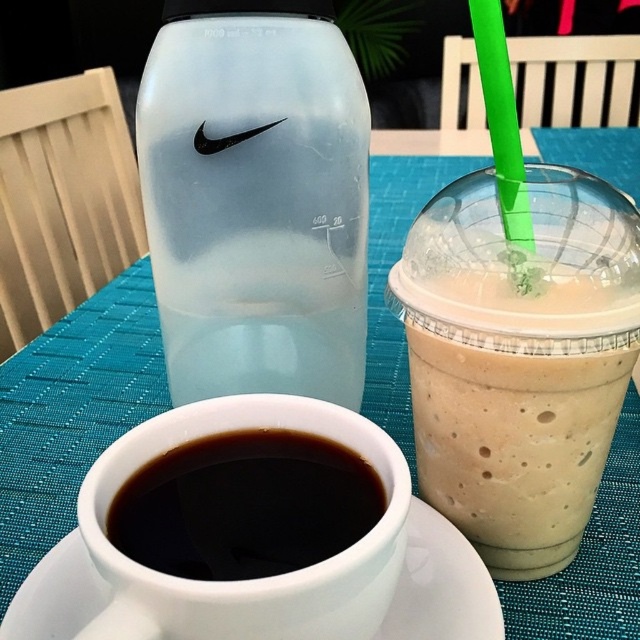
In the scene shown: Which of these two, frosted glass bottle at center or milkshake plastic cup at right, stands shorter?

milkshake plastic cup at right

Describe the element at coordinates (257, 205) in the screenshot. I see `frosted glass bottle at center` at that location.

In order to click on frosted glass bottle at center in this screenshot , I will do `click(257, 205)`.

Can you confirm if black matte cup at center is positioned below white ceramic saucer at lower center?

No, black matte cup at center is not below white ceramic saucer at lower center.

Does black matte cup at center have a larger size compared to white ceramic saucer at lower center?

Actually, black matte cup at center might be smaller than white ceramic saucer at lower center.

Image resolution: width=640 pixels, height=640 pixels. Describe the element at coordinates (244, 506) in the screenshot. I see `black matte cup at center` at that location.

I want to click on black matte cup at center, so click(x=244, y=506).

Which is in front, point (538, 380) or point (428, 604)?

Point (538, 380) is more forward.

Is milkshake plastic cup at right above white ceramic saucer at lower center?

Yes.

Who is more forward, (525, 292) or (68, 593)?

Point (525, 292) is more forward.

At what (x,y) coordinates should I click in order to perform the action: click on milkshake plastic cup at right. Please return your answer as a coordinate pair (x, y). The image size is (640, 640). Looking at the image, I should click on (518, 358).